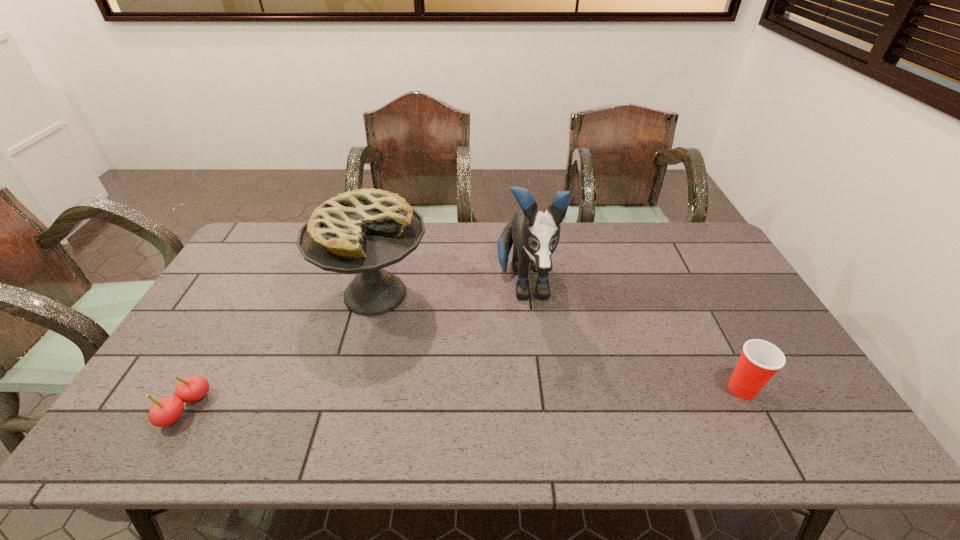
Where is `object present at the left edge`? Image resolution: width=960 pixels, height=540 pixels. object present at the left edge is located at coordinates (166, 411).

Locate an element on the screen. The image size is (960, 540). object located in the right edge section of the desktop is located at coordinates (760, 360).

Locate an element on the screen. Image resolution: width=960 pixels, height=540 pixels. object located at the near left corner is located at coordinates (166, 411).

The height and width of the screenshot is (540, 960). What are the coordinates of `object that is at the near right corner` in the screenshot? It's located at (760, 360).

The width and height of the screenshot is (960, 540). I want to click on free space at the far edge of the desktop, so click(638, 248).

In the image, there is a desktop. Identify the location of vacant space at the near edge. (574, 408).

This screenshot has height=540, width=960. Find the location of `vacant space at the left edge`. vacant space at the left edge is located at coordinates (237, 265).

At what (x,y) coordinates should I click in order to perform the action: click on free space between the tallest object and the second shortest object. Please return your answer as a coordinate pair (x, y). This screenshot has width=960, height=540. Looking at the image, I should click on (633, 338).

Find the location of a particular element. The image size is (960, 540). free space between the pie and the third object from left to right is located at coordinates (449, 290).

Identify the location of vacant region between the third object from right to left and the rightmost object. Image resolution: width=960 pixels, height=540 pixels. (559, 342).